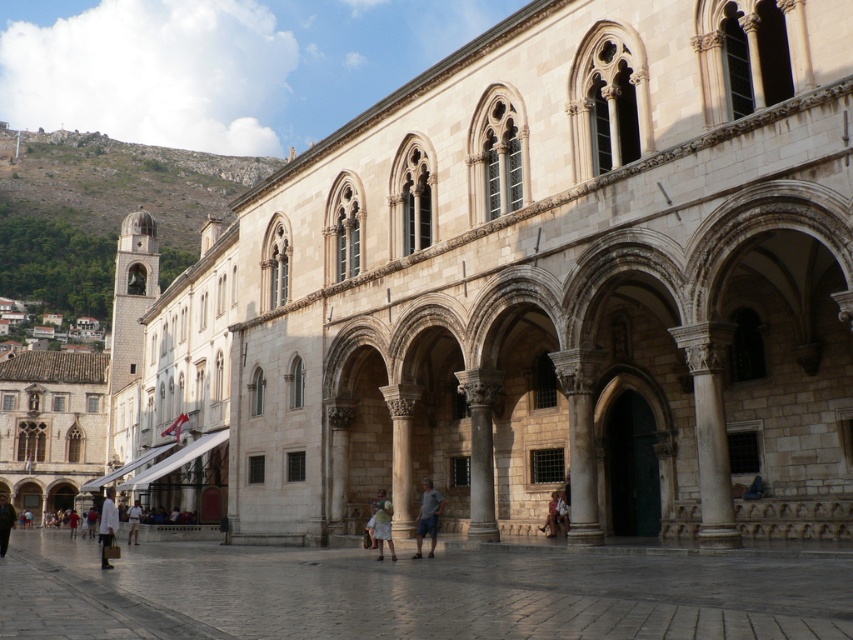
Question: Is light beige fabric bag at center positioned at the back of dark green jacket at center?

Choices:
 (A) yes
 (B) no

Answer: (B)

Question: Among these objects, which one is nearest to the camera?

Choices:
 (A) light beige stone column at center
 (B) white stone column at center
 (C) white fabric bag at lower left
 (D) smooth stone column at center

Answer: (C)

Question: Which point is closer to the camera?

Choices:
 (A) light blue denim shorts at center
 (B) white fabric bag at lower left

Answer: (B)

Question: Which of the following is the closest to the observer?

Choices:
 (A) (128, 508)
 (B) (172, 634)

Answer: (B)

Question: Can you confirm if smooth stone column at center is thinner than light beige shorts at center?

Choices:
 (A) no
 (B) yes

Answer: (B)

Question: Is white fabric bag at lower left further to the viewer compared to dark green jacket at center?

Choices:
 (A) yes
 (B) no

Answer: (B)